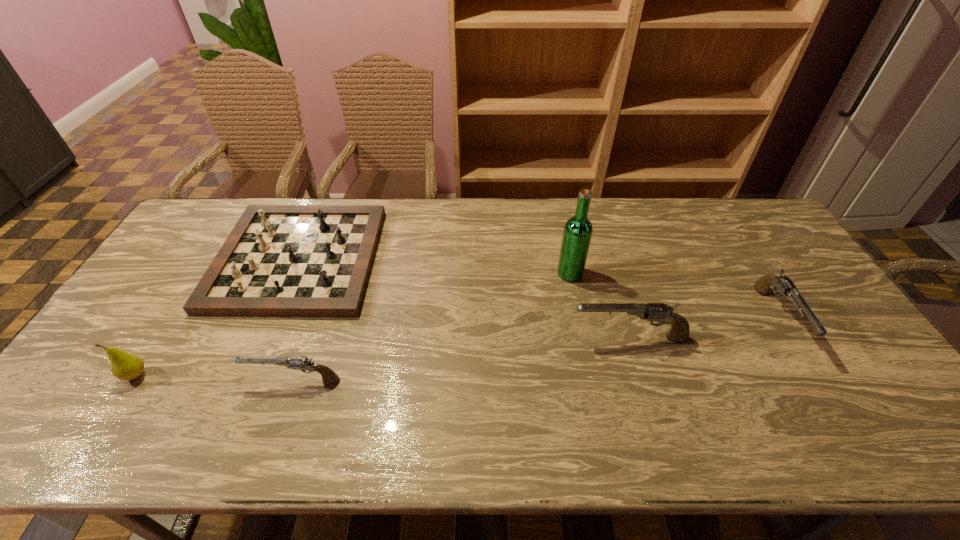
The height and width of the screenshot is (540, 960). I want to click on empty space between the second gun from left to right and the chessboard, so click(x=464, y=298).

In order to click on blank region between the chessboard and the second shortest gun in this screenshot , I will do `click(538, 288)`.

Where is `vacant space that's between the chessboard and the beer bottle`? This screenshot has width=960, height=540. vacant space that's between the chessboard and the beer bottle is located at coordinates (434, 266).

Locate an element on the screen. free space between the nearest gun and the second tallest gun is located at coordinates (536, 349).

This screenshot has width=960, height=540. I want to click on free spot between the beer bottle and the rightmost gun, so click(674, 296).

The image size is (960, 540). In order to click on free area in between the beer bottle and the chessboard in this screenshot , I will do `click(434, 266)`.

You are a GUI agent. You are given a task and a screenshot of the screen. Output one action in this format:
    pyautogui.click(x=<x>, y=<y>)
    Task: Click on the free point between the rightmost gun and the leftmost object
    The height and width of the screenshot is (540, 960).
    Given the screenshot: What is the action you would take?
    pyautogui.click(x=457, y=347)

Locate an element on the screen. This screenshot has width=960, height=540. empty location between the nearest gun and the second gun from right to left is located at coordinates (462, 359).

The width and height of the screenshot is (960, 540). Find the location of `free spot between the pear and the second gun from left to right`. free spot between the pear and the second gun from left to right is located at coordinates (383, 356).

You are a GUI agent. You are given a task and a screenshot of the screen. Output one action in this format:
    pyautogui.click(x=<x>, y=<y>)
    Task: Click on the free point between the rightmost object and the chessboard
    The height and width of the screenshot is (540, 960).
    Given the screenshot: What is the action you would take?
    pyautogui.click(x=538, y=288)